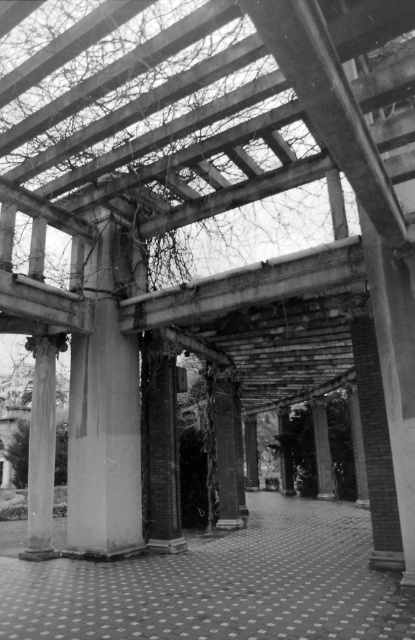
Question: Is smooth concrete column at center behind smooth stone column at center?

Choices:
 (A) yes
 (B) no

Answer: (B)

Question: Does concrete column at center appear under smooth stone column at center?

Choices:
 (A) yes
 (B) no

Answer: (B)

Question: Is concrete column at center wider than smooth concrete column at center?

Choices:
 (A) yes
 (B) no

Answer: (A)

Question: Which object is positioned closest to the smooth concrete pillar at center?

Choices:
 (A) smooth stone column at center
 (B) smooth concrete column at center
 (C) concrete column at center

Answer: (A)

Question: Which is nearer to the smooth stone column at center?

Choices:
 (A) concrete column at center
 (B) smooth concrete pillar at center

Answer: (A)

Question: Estimate the real-world distances between objects in this image. Which object is farther from the smooth concrete column at center?

Choices:
 (A) smooth concrete pillar at center
 (B) smooth stone column at center
 (C) concrete column at center

Answer: (A)